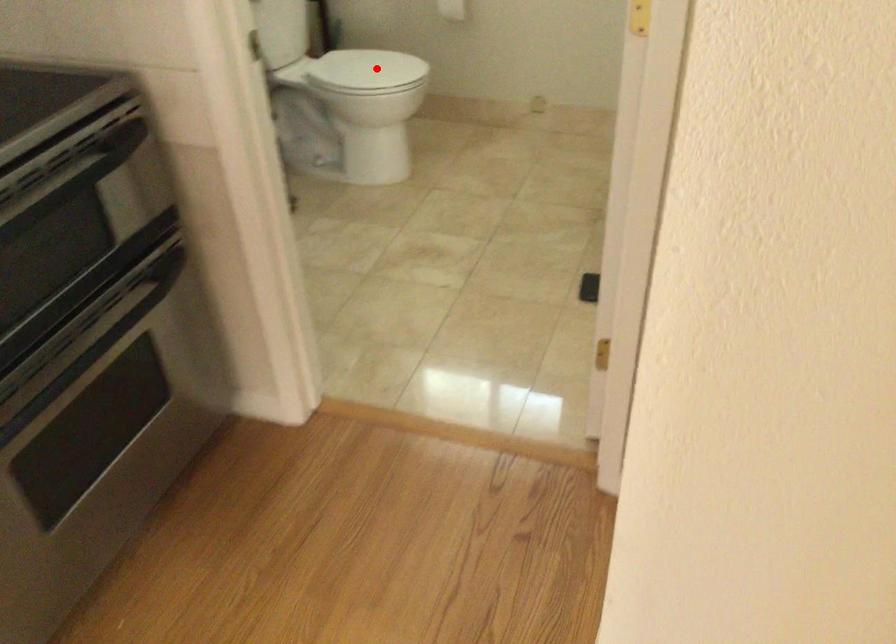
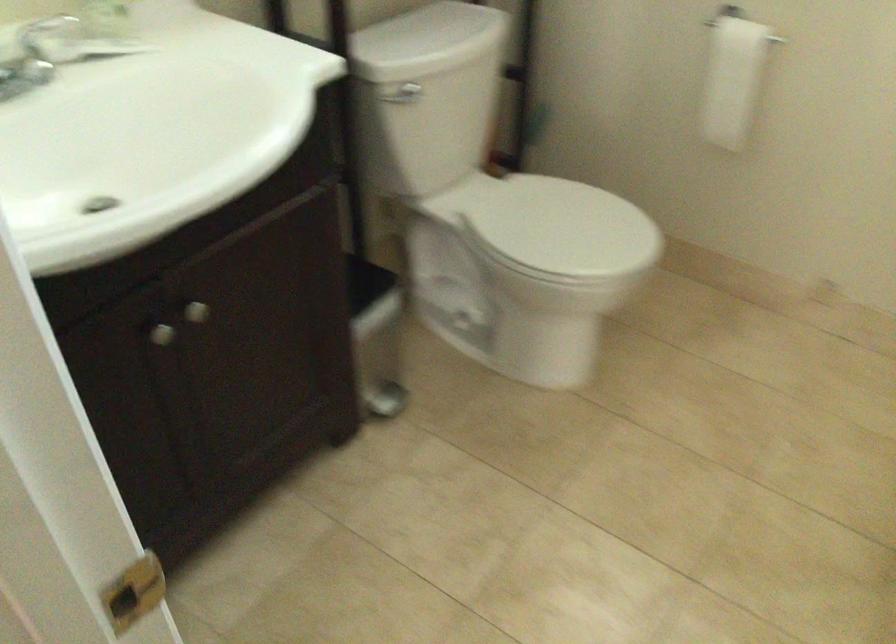
Question: I am providing you with two images of the same scene from different viewpoints. Given a red point in image1, look at the same physical point in image2. Is it:

Choices:
 (A) Closer to the viewpoint
 (B) Farther from the viewpoint

Answer: (A)